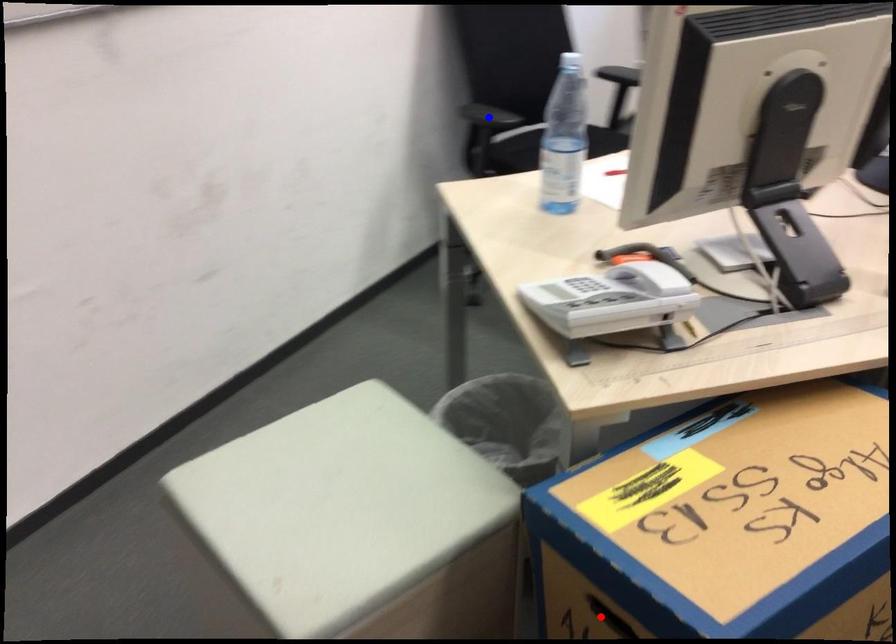
Question: In the image, two points are highlighted. Which point is nearer to the camera? Reply with the corresponding letter.

Choices:
 (A) blue point
 (B) red point

Answer: (B)